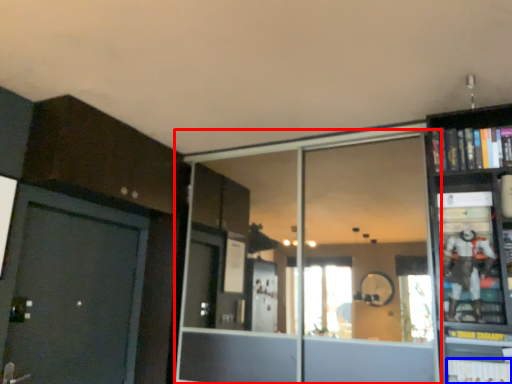
Question: Which of the following is the farthest to the observer, glass door (highlighted by a red box) or book (highlighted by a blue box)?

Choices:
 (A) glass door
 (B) book

Answer: (A)